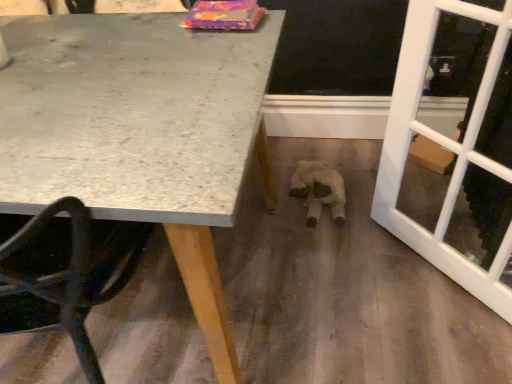
Question: Is granite table at upper left bigger or smaller than white plush toy at center?

Choices:
 (A) small
 (B) big

Answer: (B)

Question: From their relative heights in the image, would you say granite table at upper left is taller or shorter than white plush toy at center?

Choices:
 (A) short
 (B) tall

Answer: (B)

Question: Estimate the real-world distances between objects in this image. Which object is farther from the granite table at upper left?

Choices:
 (A) white glass screen door at right
 (B) white plush toy at center

Answer: (B)

Question: Considering the real-world distances, which object is farthest from the granite table at upper left?

Choices:
 (A) white plush toy at center
 (B) white glass screen door at right

Answer: (A)